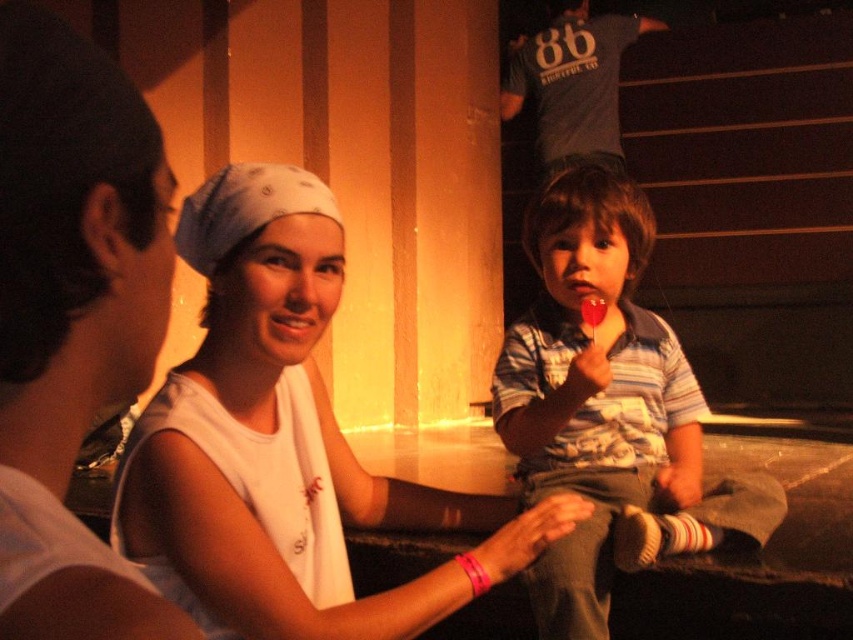
Does white fabric headband at center appear under striped cotton shirt at center?

Yes.

Can you confirm if white fabric headband at center is positioned to the left of striped cotton shirt at center?

Result: Yes, white fabric headband at center is to the left of striped cotton shirt at center.

I want to click on white fabric headband at center, so click(x=283, y=444).

The height and width of the screenshot is (640, 853). Identify the location of white fabric headband at center. (283, 444).